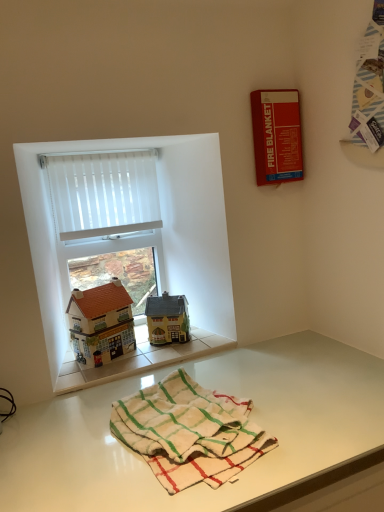
Question: Is white glossy table at lower center wider or thinner than white cotton bath towel at lower center?

Choices:
 (A) thin
 (B) wide

Answer: (B)

Question: Does point (185, 364) appear closer or farther from the camera than point (165, 394)?

Choices:
 (A) closer
 (B) farther

Answer: (B)

Question: Which is farther from the matte yellow house at center, which ranks as the first toy in right-to-left order?

Choices:
 (A) red matte fire blanket at upper right
 (B) white glossy table at lower center
 (C) white vertical blinds at upper left
 (D) white cotton bath towel at lower center
 (E) matte brown house at left, the second toy viewed from the right

Answer: (A)

Question: Considering the real-world distances, which object is farthest from the white cotton bath towel at lower center?

Choices:
 (A) red matte fire blanket at upper right
 (B) white glossy table at lower center
 (C) white sheer curtain at upper left
 (D) white vertical blinds at upper left
 (E) matte brown house at left, the second toy viewed from the right

Answer: (A)